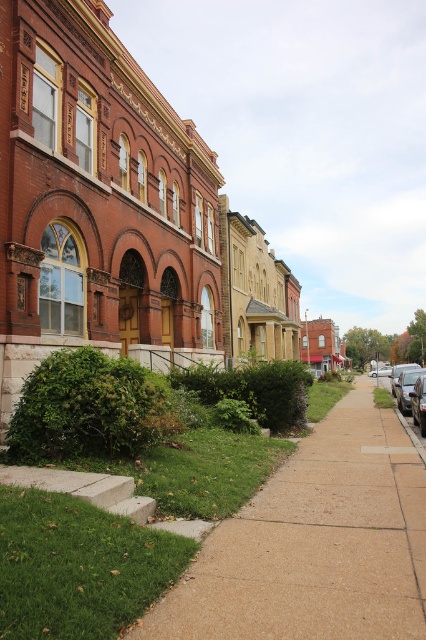
Does shiny silver sedan at right have a smaller size compared to metallic silver sedan at right?

Incorrect, shiny silver sedan at right is not smaller in size than metallic silver sedan at right.

Is point (394, 392) closer to viewer compared to point (417, 392)?

No, it is behind (417, 392).

Where is `shiny silver sedan at right`? shiny silver sedan at right is located at coordinates (405, 387).

Is point (405, 380) positioned after point (385, 371)?

No, (405, 380) is in front of (385, 371).

What are the coordinates of `shiny silver sedan at right` in the screenshot? It's located at (405, 387).

Is point (207, 632) more distant than point (420, 416)?

No, (207, 632) is in front of (420, 416).

Can you confirm if brown concrete sidewalk at lower center is bigger than metallic silver sedan at right?

Yes.

Who is more forward, (x=324, y=483) or (x=417, y=413)?

Point (x=324, y=483) is in front.

This screenshot has width=426, height=640. In order to click on brown concrete sidewalk at lower center in this screenshot , I will do `click(314, 544)`.